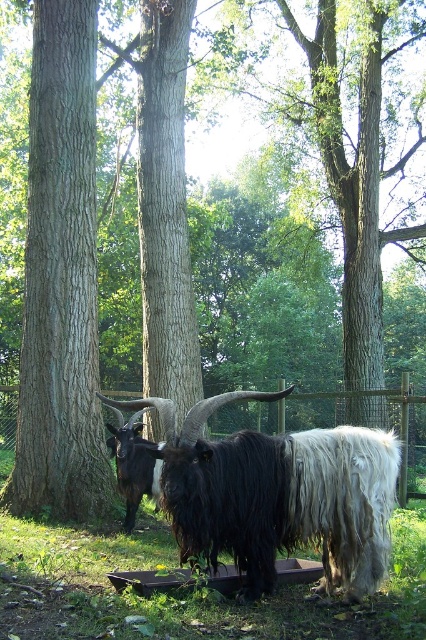
Can you confirm if black woolly goat at center is taller than metal wire fence at center?

Incorrect, black woolly goat at center's height is not larger of metal wire fence at center's.

Between point (351, 525) and point (11, 385), which one is positioned behind?

The point (11, 385) is behind.

Where is `black woolly goat at center`? The image size is (426, 640). black woolly goat at center is located at coordinates (278, 493).

Consider the image. Between dark brown fur goat at left and metal wire fence at center, which one is positioned lower?

Positioned lower is metal wire fence at center.

Does dark brown fur goat at left appear on the right side of metal wire fence at center?

Indeed, dark brown fur goat at left is positioned on the right side of metal wire fence at center.

Which is in front, point (120, 465) or point (403, 480)?

Point (120, 465) is in front.

The height and width of the screenshot is (640, 426). In order to click on dark brown fur goat at left in this screenshot , I will do `click(134, 461)`.

In the scene shown: Is black woolly goat at center positioned in front of dark brown fur goat at left?

Yes, it is.

Which is in front, point (310, 538) or point (115, 445)?

Point (310, 538) is more forward.

Where is `black woolly goat at center`? Image resolution: width=426 pixels, height=640 pixels. black woolly goat at center is located at coordinates (278, 493).